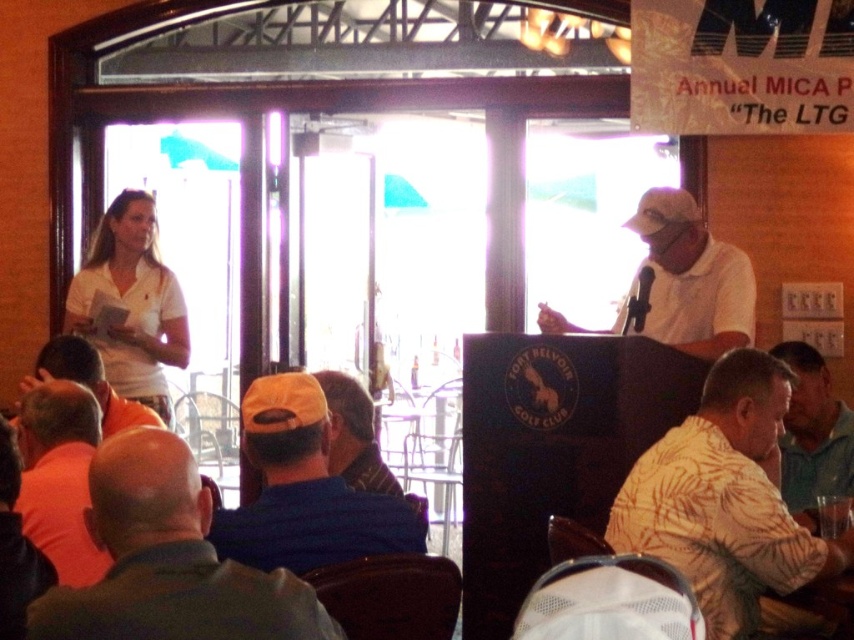
You are standing at the entrance of the room and want to locate the yellow floral shirt at lower right. According to the coordinates provided, where should you look relative to the center of the image?

The yellow floral shirt at lower right is located at point 0.786 on the x axis and 0.851 on the y axis, so you should look to the right and slightly downward from the center of the image.